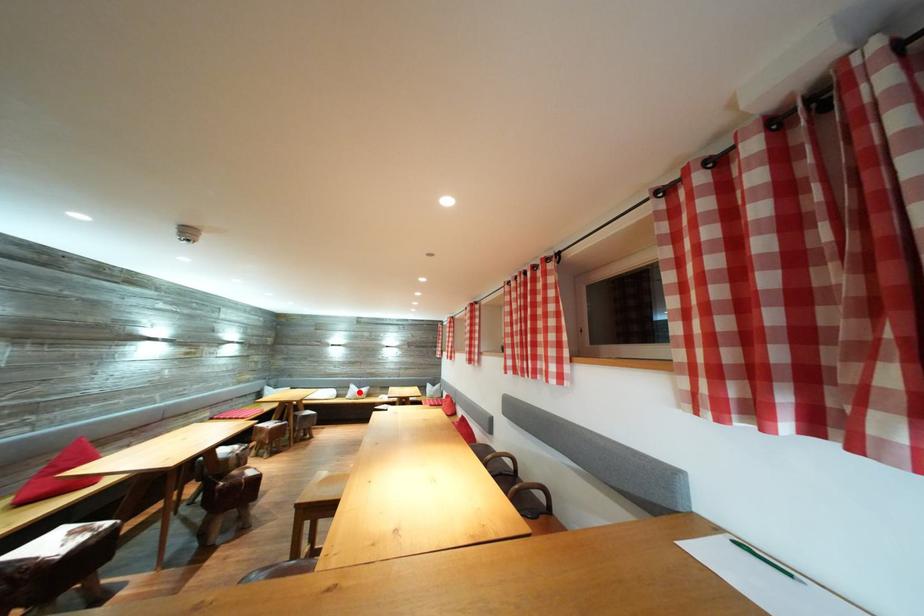
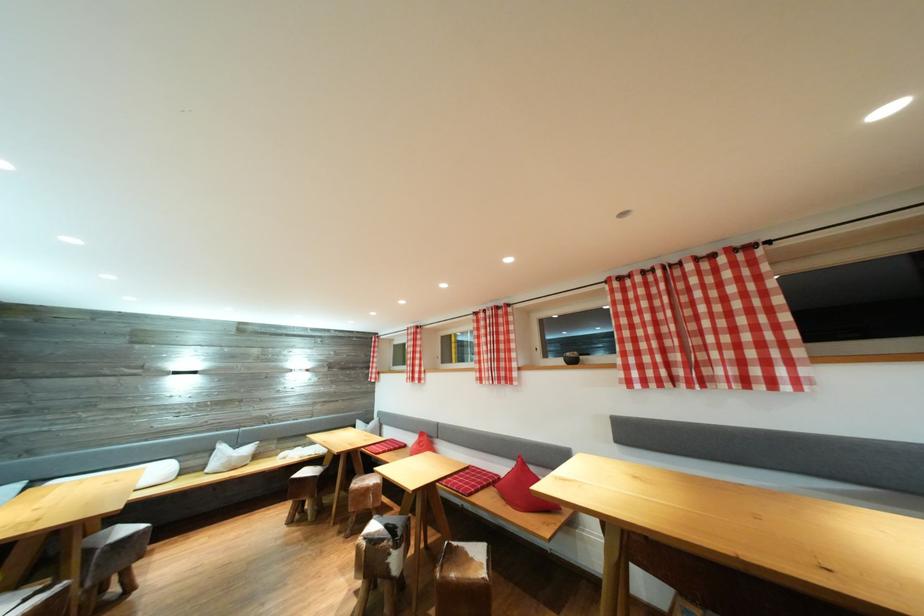
Locate, in the second image, the point that corresponds to the highlighted location in the first image.

(228, 453)